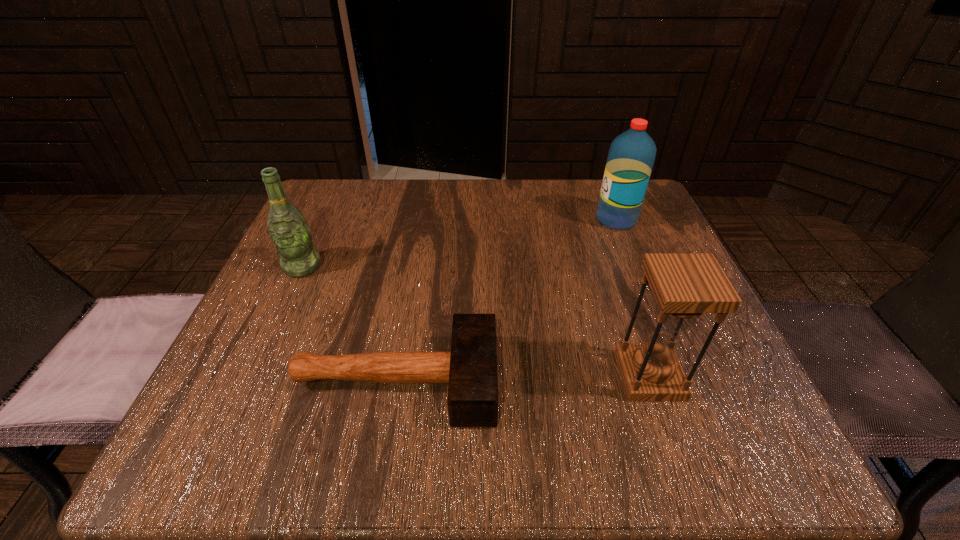
Where is `free space that is in between the hourglass and the farthest object`? free space that is in between the hourglass and the farthest object is located at coordinates (633, 298).

At what (x,y) coordinates should I click in order to perform the action: click on blank region between the farthest object and the mallet. Please return your answer as a coordinate pair (x, y). Looking at the image, I should click on (506, 300).

Identify the location of free point between the second farthest object and the shortest object. (349, 323).

What are the coordinates of `free space between the leftmost object and the farthest object` in the screenshot? It's located at (460, 243).

Locate which object is the third closest to the shortest object. Please provide its 2D coordinates. Your answer should be formatted as a tuple, i.e. [(x, y)], where the tuple contains the x and y coordinates of a point satisfying the conditions above.

[(631, 156)]

Locate an element on the screen. The image size is (960, 540). object that stands as the second closest to the water bottle is located at coordinates (470, 368).

Where is `vacant area that satisfies the following two spatial constraints: 1. on the surface of the hourglass; 2. on the right side of the leftmost object`? This screenshot has width=960, height=540. vacant area that satisfies the following two spatial constraints: 1. on the surface of the hourglass; 2. on the right side of the leftmost object is located at coordinates (252, 376).

Where is `vacant space that satisfies the following two spatial constraints: 1. on the front side of the hourglass; 2. on the hammer head face of the shortest object`? vacant space that satisfies the following two spatial constraints: 1. on the front side of the hourglass; 2. on the hammer head face of the shortest object is located at coordinates (651, 381).

Where is `free space that satisfies the following two spatial constraints: 1. on the front label of the water bottle; 2. on the surface of the third nearest object`? free space that satisfies the following two spatial constraints: 1. on the front label of the water bottle; 2. on the surface of the third nearest object is located at coordinates (635, 267).